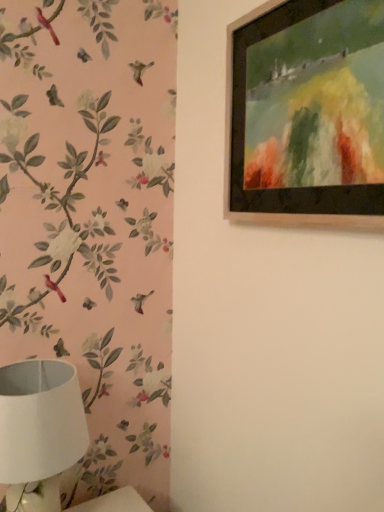
Question: From the image's perspective, is wooden picture frame at upper right positioned above or below white matte lampshade at lower left?

Choices:
 (A) above
 (B) below

Answer: (A)

Question: In terms of size, does wooden picture frame at upper right appear bigger or smaller than white matte lampshade at lower left?

Choices:
 (A) small
 (B) big

Answer: (A)

Question: From a real-world perspective, is wooden picture frame at upper right above or below white matte lampshade at lower left?

Choices:
 (A) above
 (B) below

Answer: (A)

Question: Visually, is white matte lampshade at lower left positioned to the left or to the right of wooden picture frame at upper right?

Choices:
 (A) right
 (B) left

Answer: (B)

Question: In terms of width, does white matte lampshade at lower left look wider or thinner when compared to wooden picture frame at upper right?

Choices:
 (A) thin
 (B) wide

Answer: (B)

Question: Which is correct: white matte lampshade at lower left is inside wooden picture frame at upper right, or outside of it?

Choices:
 (A) inside
 (B) outside

Answer: (B)

Question: Relative to wooden picture frame at upper right, is white matte lampshade at lower left in front or behind?

Choices:
 (A) behind
 (B) front

Answer: (A)